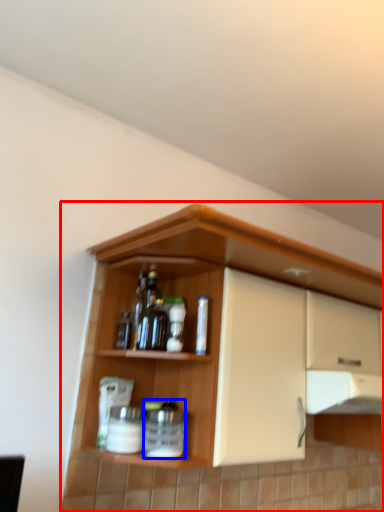
Question: Which object appears closest to the camera in this image, cupboard (highlighted by a red box) or beverage (highlighted by a blue box)?

Choices:
 (A) cupboard
 (B) beverage

Answer: (A)